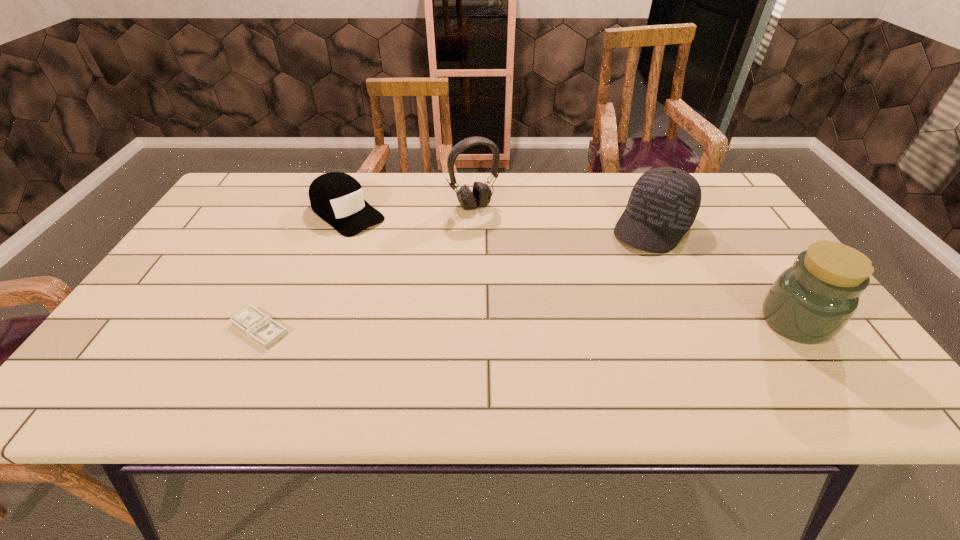
You are a GUI agent. You are given a task and a screenshot of the screen. Output one action in this format:
    pyautogui.click(x=<x>, y=<y>)
    Task: Click on the money
    The image size is (960, 540).
    Given the screenshot: What is the action you would take?
    pyautogui.click(x=261, y=328)

Where is `jar`? This screenshot has height=540, width=960. jar is located at coordinates (810, 302).

Where is `headset`? This screenshot has width=960, height=540. headset is located at coordinates (480, 196).

Find the location of `baseball cap`. baseball cap is located at coordinates (664, 202).

Find the location of a particular element. Image resolution: width=960 pixels, height=540 pixels. the third shortest object is located at coordinates (664, 202).

Find the location of a particular element. the second shortest object is located at coordinates (337, 198).

Locate an element on the screen. vacant region located on the left of the shortest object is located at coordinates (207, 329).

The width and height of the screenshot is (960, 540). Find the location of `free space located 0.090m on the left of the rightmost object`. free space located 0.090m on the left of the rightmost object is located at coordinates (722, 322).

You are a GUI agent. You are given a task and a screenshot of the screen. Output one action in this format:
    pyautogui.click(x=<x>, y=<y>)
    Task: Click on the free space located 0.370m on the front-facing side of the third object from left to right
    This screenshot has width=960, height=540.
    Given the screenshot: What is the action you would take?
    pyautogui.click(x=548, y=294)

The width and height of the screenshot is (960, 540). In order to click on free space located on the front-facing side of the third object from left to right in this screenshot , I will do `click(550, 297)`.